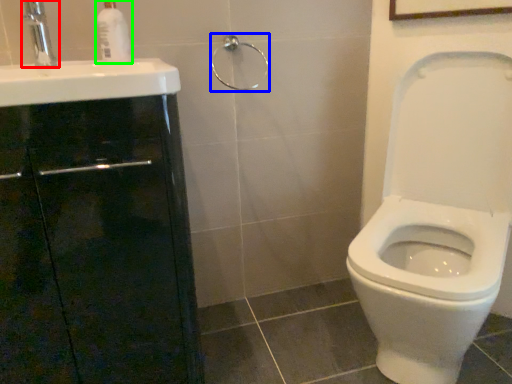
Question: Based on their relative distances, which object is farther from tap (highlighted by a red box)? Choose from shower (highlighted by a blue box) and soap dispenser (highlighted by a green box).

Choices:
 (A) shower
 (B) soap dispenser

Answer: (A)